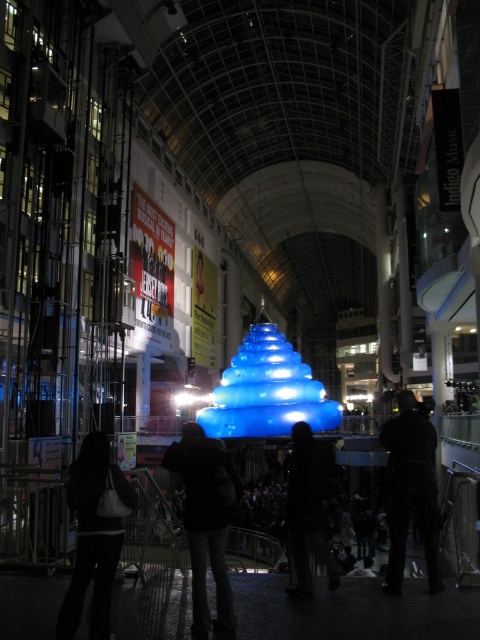
You are standing at the entrance of the shopping mall and see the point marked at coordinates (94,538). What object is located at that point?

The point at coordinates (94,538) indicates the location of the black fabric bag at lower left.